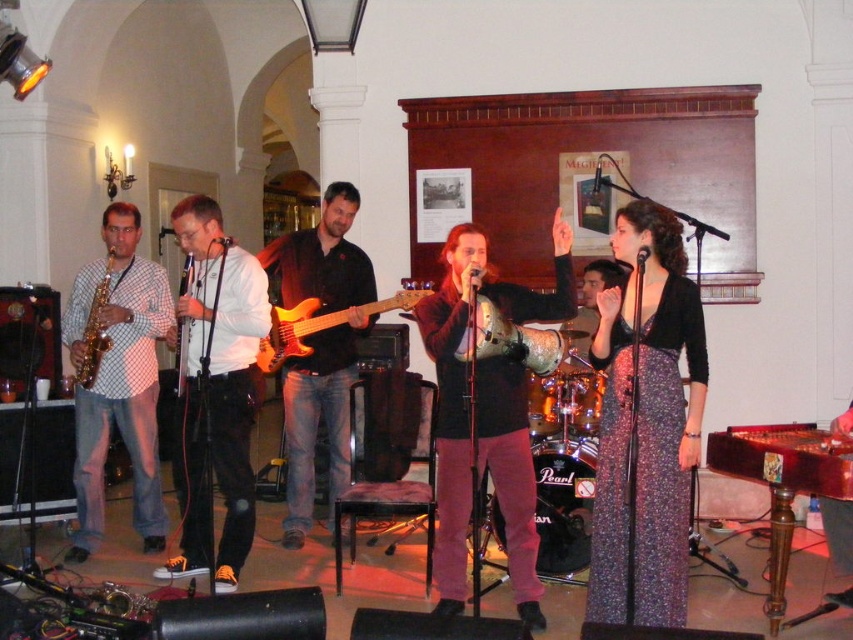
You are a photographer at the back of the venue and want to take a closeup shot of the metallic silver tambourine at center and the white glossy shirt at center. Which one is closer to you?

The metallic silver tambourine at center is closer to you because it is in front of the white glossy shirt at center.

You are a photographer standing at the front of the stage. You want to take a photo that includes both the point at coordinates point (131, 355) and point (332, 204). Which point should you focus on first to ensure both are in focus?

You should focus on point (131, 355) first because it is closer to the camera than point (332, 204), so focusing on the closer point will ensure the farther point is also in focus.